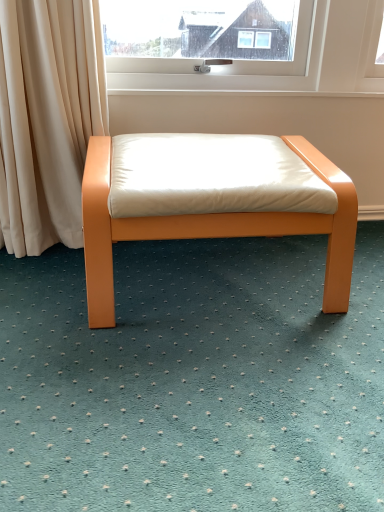
The height and width of the screenshot is (512, 384). What do you see at coordinates (212, 228) in the screenshot? I see `matte orange bench at center` at bounding box center [212, 228].

Find the location of a particular element. This screenshot has height=512, width=384. matte orange bench at center is located at coordinates (212, 228).

Locate an element on the screen. matte orange bench at center is located at coordinates (212, 228).